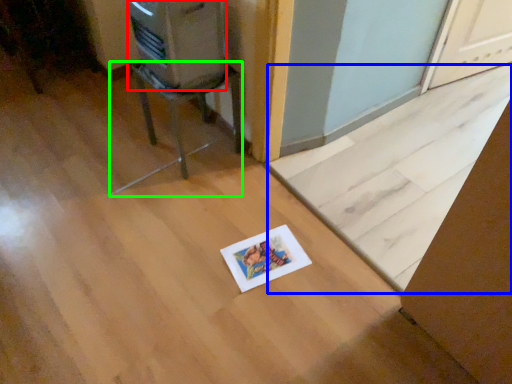
Question: Which is farther away from appliance (highlighted by a red box)? doormat (highlighted by a blue box) or furniture (highlighted by a green box)?

Choices:
 (A) doormat
 (B) furniture

Answer: (A)